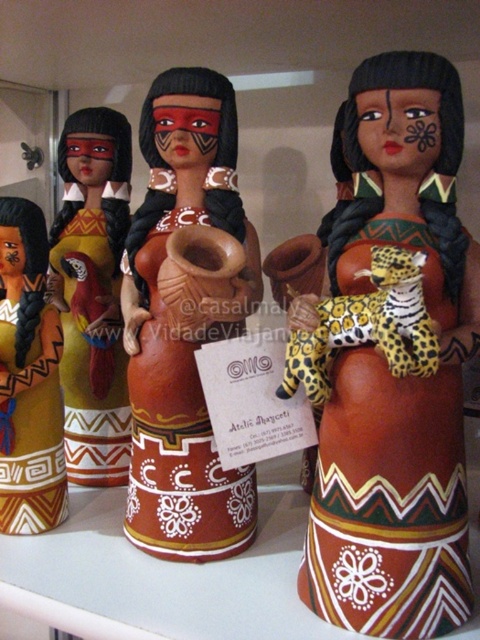
Question: Can you confirm if terracotta figure at center is smaller than matte clay figurine at center?

Choices:
 (A) no
 (B) yes

Answer: (A)

Question: Which is nearer to the terracotta figure at center?

Choices:
 (A) matte clay figurine at center
 (B) matte clay doll at center
 (C) matte clay figure at center

Answer: (A)

Question: Can you confirm if terracotta figure at center is positioned above matte clay figurine at center?

Choices:
 (A) yes
 (B) no

Answer: (A)

Question: Does matte clay figure at center have a smaller size compared to matte clay figurine at center?

Choices:
 (A) yes
 (B) no

Answer: (B)

Question: Which of the following is the closest to the observer?

Choices:
 (A) terracotta figure at center
 (B) matte clay figure at center

Answer: (B)

Question: Which point is closer to the camera?

Choices:
 (A) pyautogui.click(x=33, y=456)
 (B) pyautogui.click(x=106, y=138)
 (C) pyautogui.click(x=233, y=321)

Answer: (C)